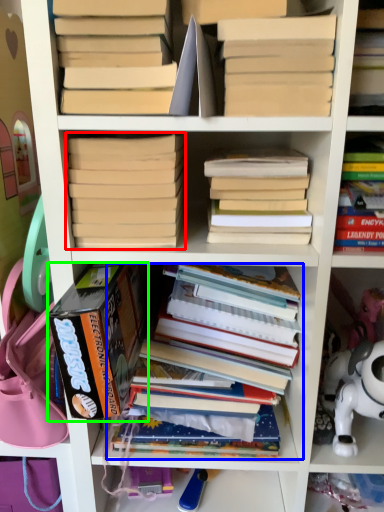
Question: Considering the real-world distances, which object is closest to book (highlighted by a red box)? book (highlighted by a blue box) or book (highlighted by a green box).

Choices:
 (A) book
 (B) book

Answer: (B)